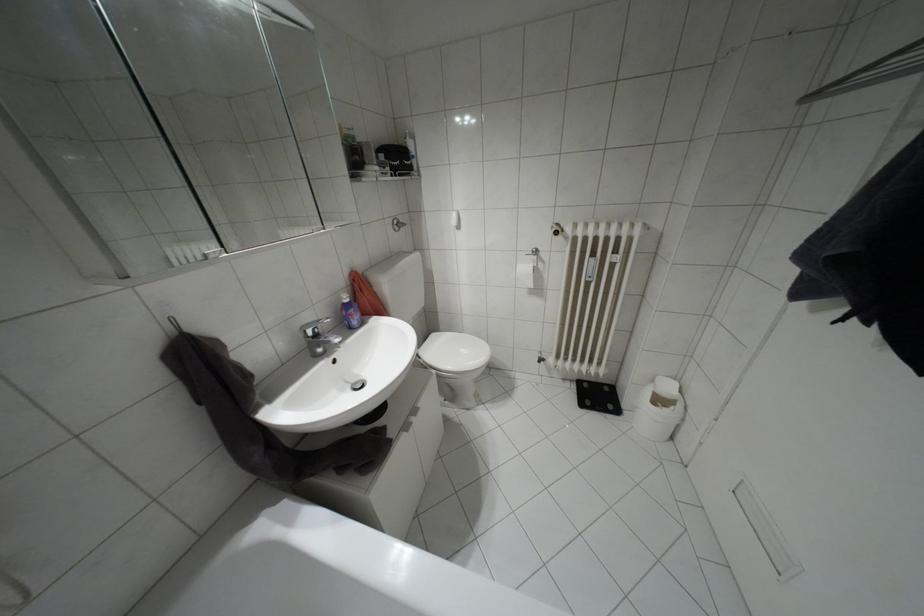
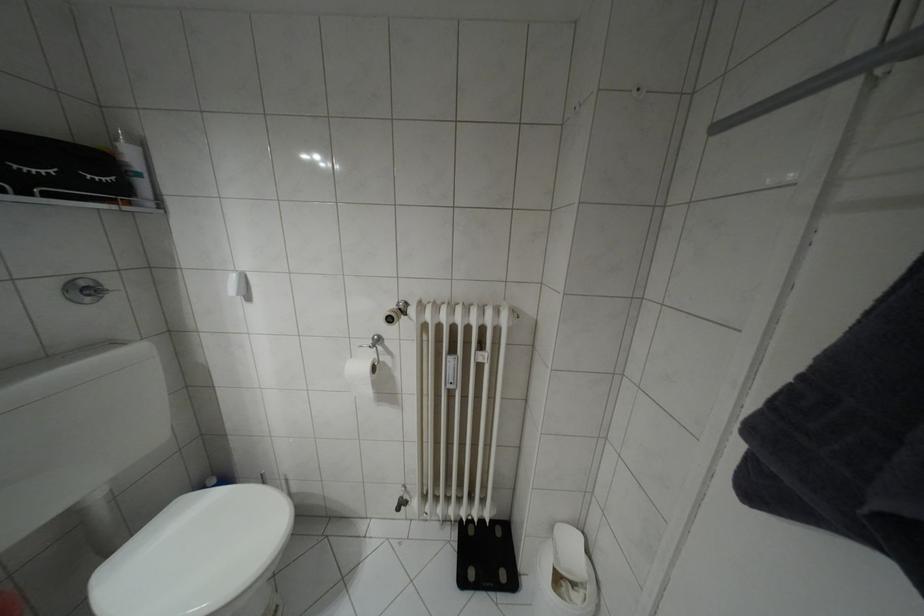
Find the pixel in the second image that matches (683,419) in the first image.

(598, 606)